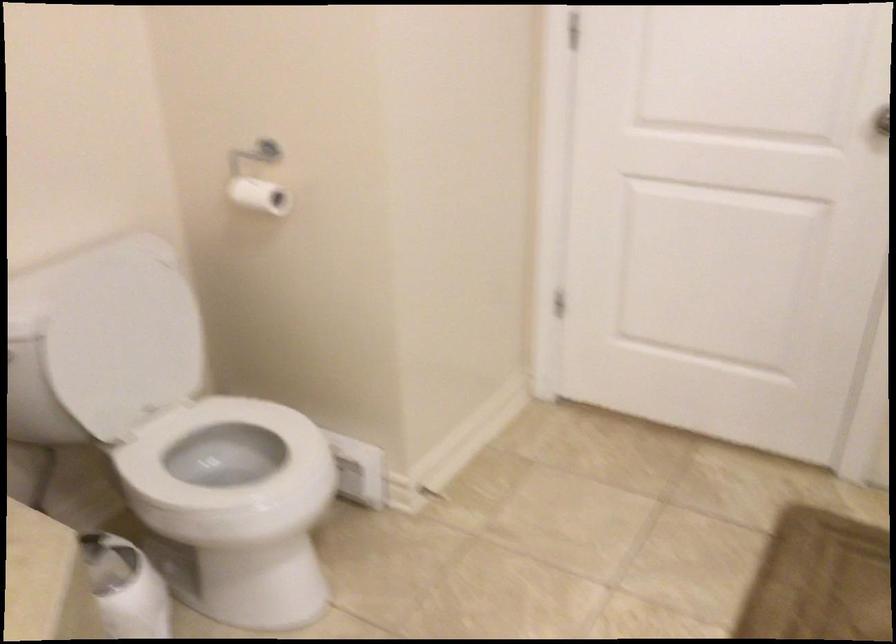
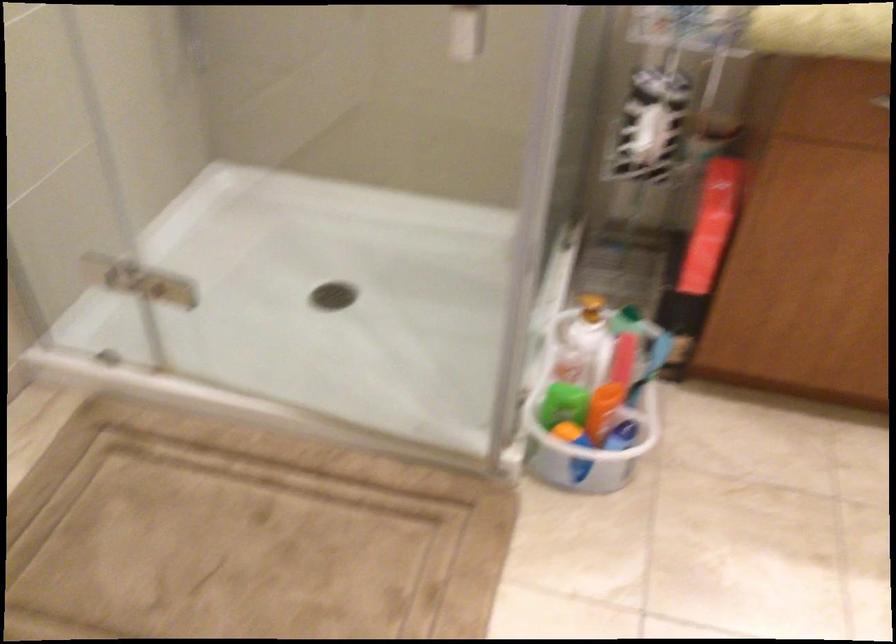
Based on the continuous images, in which direction is the camera rotating?

The camera's rotation is toward right-down.